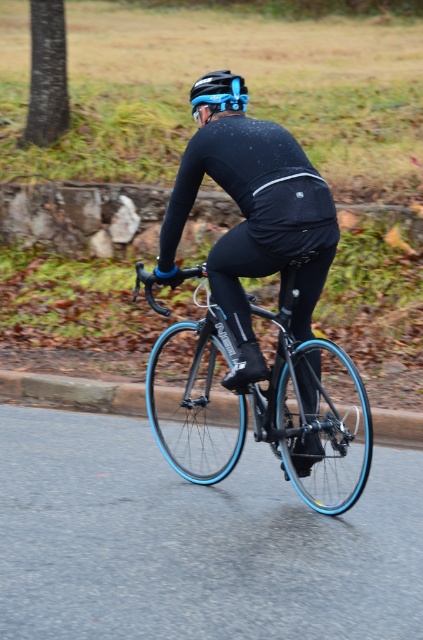
You are a photographer positioned at the starting line of a cycling race. You see the cyclist in the image wearing a matte black cycling suit at center. If the cyclist is moving towards you at a constant speed of 10 meters per second, how many seconds will it take for the cyclist to reach you?

The cyclist and the photographer are 4.46 meters apart. At a speed of 10 meters per second, it will take the cyclist 4.46 divided by 10, which equals approximately 0.446 seconds to reach the photographer.

You are a photographer trying to capture the cyclist and their gear. You want to frame both the blue glossy bicycle at center and the blue matte bicycle helmet at upper center in your shot. Which object should you place closer to the left edge of your camera frame?

The blue matte bicycle helmet at upper center should be placed closer to the left edge of the camera frame because the blue glossy bicycle at center is positioned on the right side of it.

You are a photographer trying to capture the cyclist in motion. You notice the matte black cycling suit at center and the blue matte bicycle helmet at upper center. Which object should you focus on to ensure it appears larger in your photo?

The matte black cycling suit at center should be focused on because it is bigger than the blue matte bicycle helmet at upper center.